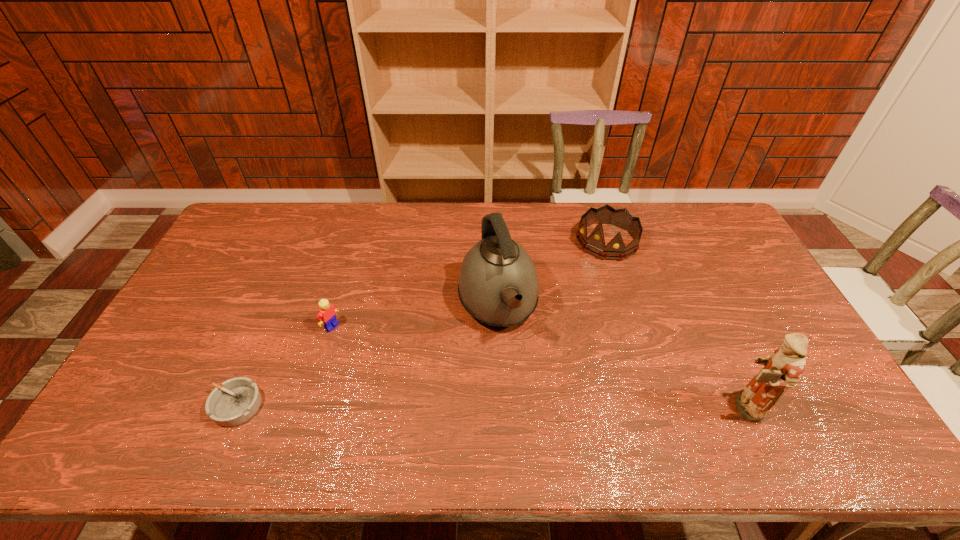
At what (x,y) coordinates should I click in order to perform the action: click on vacant space located 0.090m at the front of the third shortest object with jewels. Please return your answer as a coordinate pair (x, y). The height and width of the screenshot is (540, 960). Looking at the image, I should click on (578, 272).

Where is `object situated at the far edge`? object situated at the far edge is located at coordinates 595,243.

The width and height of the screenshot is (960, 540). I want to click on ashtray that is at the near edge, so click(234, 403).

I want to click on figurine situated at the near edge, so click(x=782, y=370).

Where is `vacant area at the far edge of the desktop`? This screenshot has width=960, height=540. vacant area at the far edge of the desktop is located at coordinates (412, 214).

Find the location of `vacant space at the left edge of the desktop`. vacant space at the left edge of the desktop is located at coordinates (252, 258).

Identify the location of blank area at the right edge. The image size is (960, 540). (732, 298).

In the image, there is a desktop. Where is `vacant space at the far right corner`? Image resolution: width=960 pixels, height=540 pixels. vacant space at the far right corner is located at coordinates (718, 222).

Where is `free point between the Lego and the third object from left to right`? free point between the Lego and the third object from left to right is located at coordinates (415, 316).

I want to click on vacant space in between the fourth object from right to left and the leftmost object, so click(284, 366).